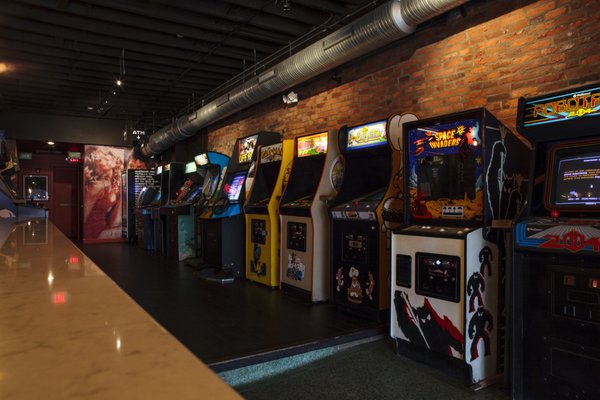
This screenshot has height=400, width=600. What are the coordinates of `lights` in the screenshot? It's located at (120, 85), (97, 105), (47, 142).